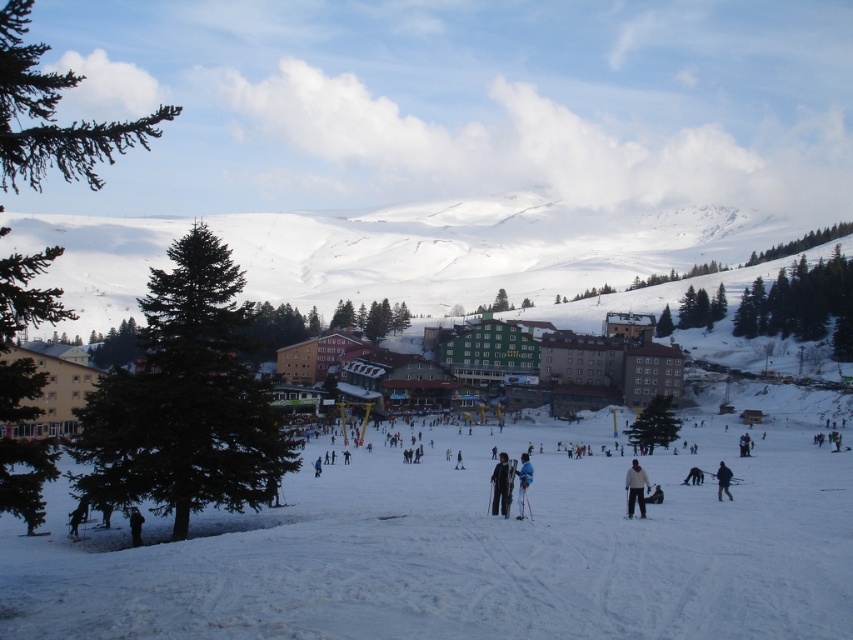
You are a photographer positioned at the edge of the snowy landscape. You notice a white matte jacket at lower center and a black fabric person at lower left in your viewfinder. Which object is closer to the foreground of the image?

The white matte jacket at lower center is closer to the foreground because it is positioned above the black fabric person at lower left, indicating it is in a higher plane within the image depth.

You are standing at the point marked as point (498,458) in the ski resort image. You want to take a photo of the snowy landscape with your camera, which has a maximum range of 100 meters. Will you be able to capture the entire snowy landscape in your photo?

The distance between you and the viewer is 117.26 meters, which exceeds your camera maximum range of 100 meters. Therefore, you will not be able to capture the entire snowy landscape in your photo.

You are a photographer standing at the edge of the ski resort, and you want to take a photo of the white matte jacket at lower center and the black fabric person at lower left. Which object should you focus on first if you want to capture both in the same frame without moving the camera?

The white matte jacket at lower center is taller than the black fabric person at lower left, so you should focus on the white matte jacket at lower center first to ensure both are in the frame.